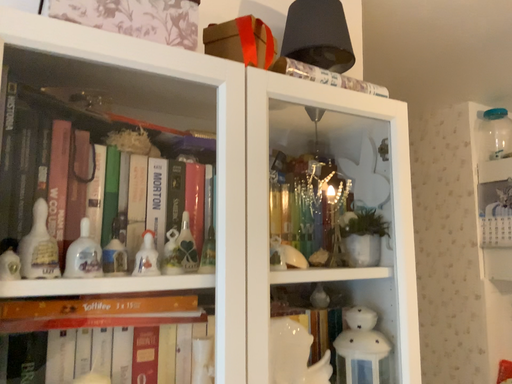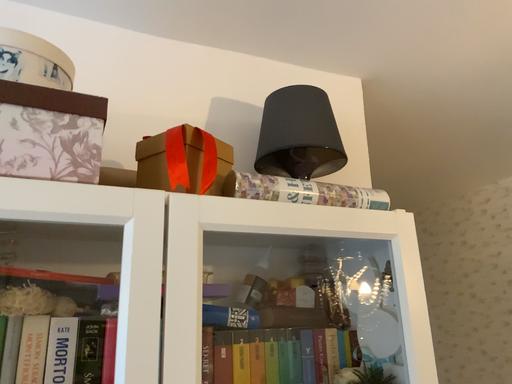
Question: Which way did the camera rotate in the video?

Choices:
 (A) rotated left
 (B) rotated right

Answer: (A)